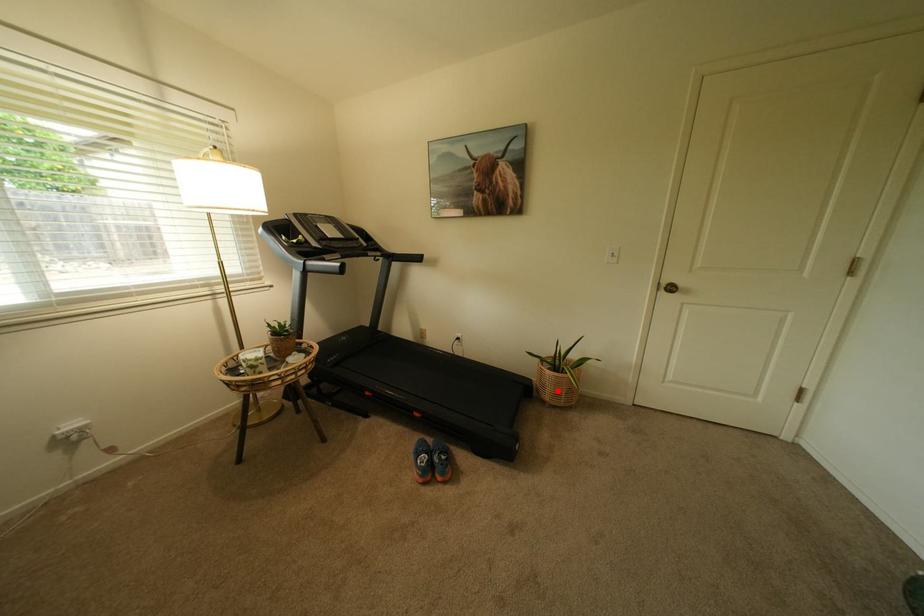
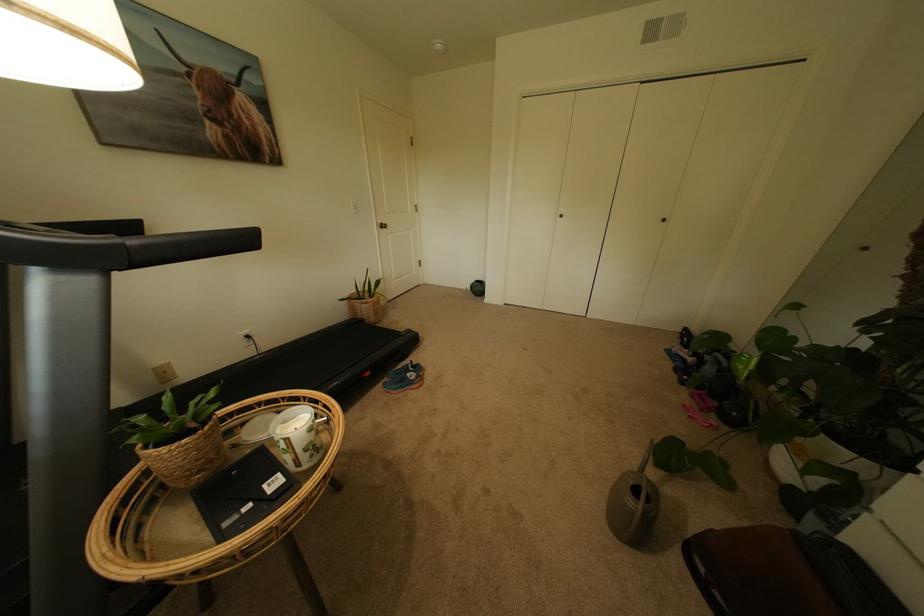
Question: A red point is marked in image1. In image2, is the corresponding 3D point closer to the camera or farther? Reply with the corresponding letter.

Choices:
 (A) The corresponding 3D point is closer.
 (B) The corresponding 3D point is farther.

Answer: (A)